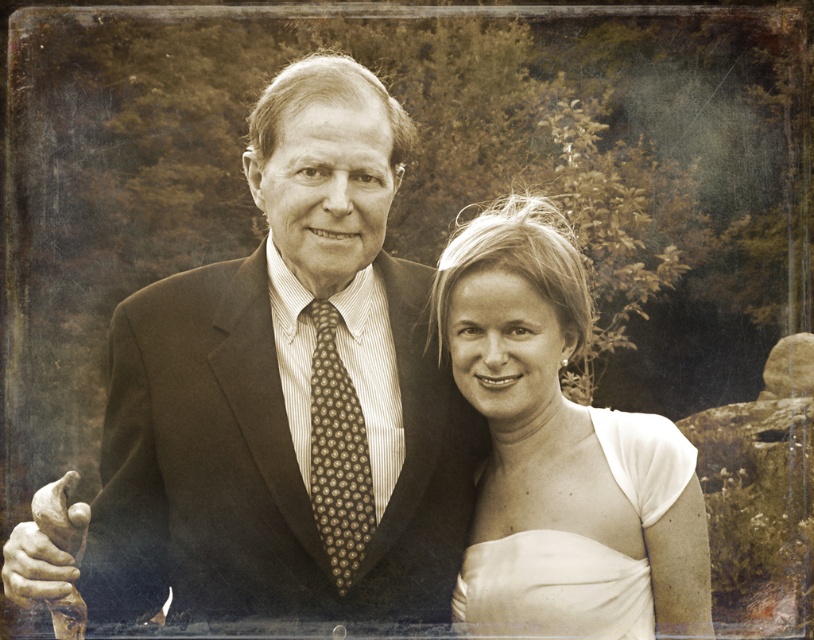
You are a photographer trying to determine if the two subjects in the image are positioned close enough for a group portrait. Given that the minimum required distance between subjects for a clear group portrait is 12 inches, can you confirm if the dark brown textured suit at center and the white satin dress at lower right are within the required distance?

The dark brown textured suit at center and white satin dress at lower right are 14.43 inches apart, which exceeds the minimum required distance of 12 inches for a clear group portrait. Therefore, they are positioned close enough.

In the scene shown: You are standing in the vintage photo scene and want to move from the point at coordinates point [655,609] to the point at coordinates point [633,483]. Which direction should you move to get closer to the latter point?

Since point [655,609] is further to the viewer than point [633,483], you should move forward towards the latter point to get closer.